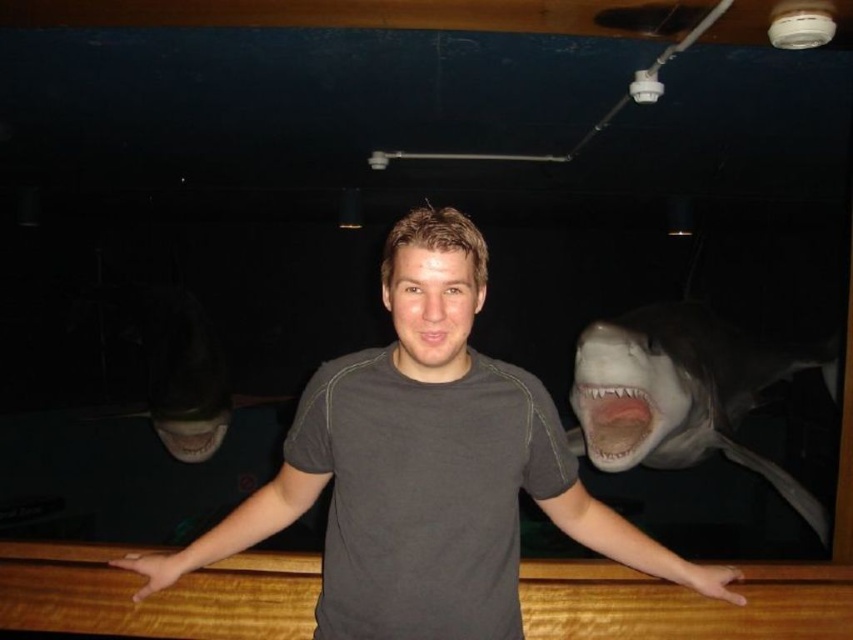
Question: Is gray cotton t-shirt at center further to the viewer compared to pink matte mouth at center?

Choices:
 (A) yes
 (B) no

Answer: (B)

Question: Is gray cotton t-shirt at center to the right of pink matte mouth at center from the viewer's perspective?

Choices:
 (A) yes
 (B) no

Answer: (A)

Question: Estimate the real-world distances between objects in this image. Which object is closer to the white glossy shark at right?

Choices:
 (A) gray cotton t-shirt at center
 (B) pink matte mouth at center

Answer: (A)

Question: Is gray cotton t-shirt at center to the right of pink matte mouth at center from the viewer's perspective?

Choices:
 (A) yes
 (B) no

Answer: (A)

Question: Estimate the real-world distances between objects in this image. Which object is closer to the gray cotton t-shirt at center?

Choices:
 (A) white glossy shark at right
 (B) pink matte mouth at center

Answer: (B)

Question: Which point is farther from the camera taking this photo?

Choices:
 (A) [x=332, y=614]
 (B) [x=426, y=349]

Answer: (A)